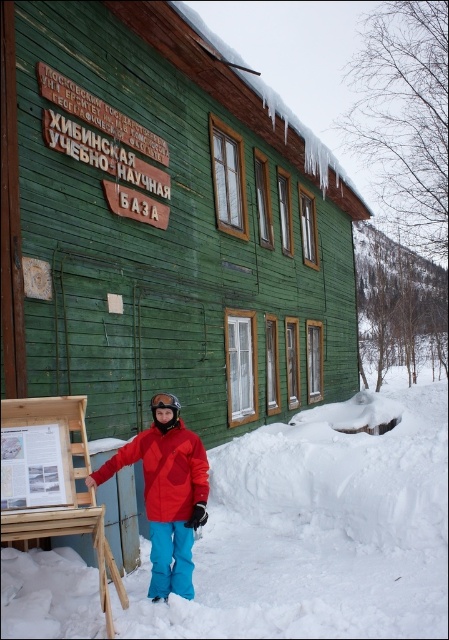
You are standing at the wooden building in the snowy scene. There is a point marked at coordinates (318, 531). What is located at that point?

The white fluffy snow at lower center is located at the coordinates point (318, 531).

You are trying to determine if a small backpack can fit between the red matte jacket at center and the black matte goggles at center. Based on their widths, can the backpack be placed there?

The red matte jacket at center might be wider than black matte goggles at center, so there may not be enough space for the backpack between them.

You are standing in front of the wooden building and notice two points marked on the map stand. The first point is at coordinates point (132, 461) and the second is at point (171, 403). Which point is closer to you?

Point (132, 461) is further to the viewer than point (171, 403), so the second point is closer to you.